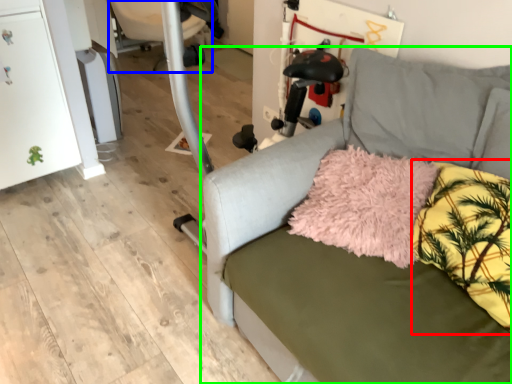
Question: Which object is positioned farthest from pillow (highlighted by a red box)? Select from swivel chair (highlighted by a blue box) and studio couch (highlighted by a green box).

Choices:
 (A) swivel chair
 (B) studio couch

Answer: (A)